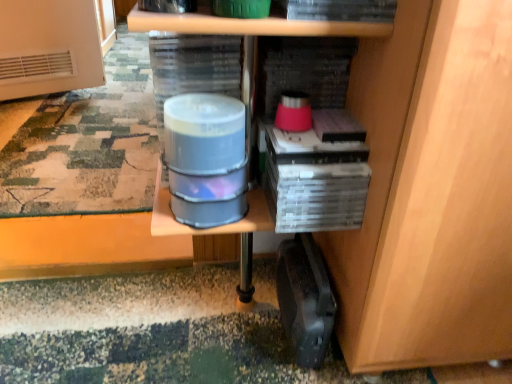
Question: Is camouflage fabric mat at lower left in front of or behind black plastic briefcase at lower right in the image?

Choices:
 (A) behind
 (B) front

Answer: (A)

Question: Considering the positions of camouflage fabric mat at lower left and black plastic briefcase at lower right in the image, is camouflage fabric mat at lower left bigger or smaller than black plastic briefcase at lower right?

Choices:
 (A) big
 (B) small

Answer: (A)

Question: Which of these objects is positioned closest to the translucent plastic water at center?

Choices:
 (A) camouflage fabric mat at lower left
 (B) black plastic briefcase at lower right

Answer: (B)

Question: Considering the real-world distances, which object is farthest from the translucent plastic water at center?

Choices:
 (A) camouflage fabric mat at lower left
 (B) black plastic briefcase at lower right

Answer: (A)